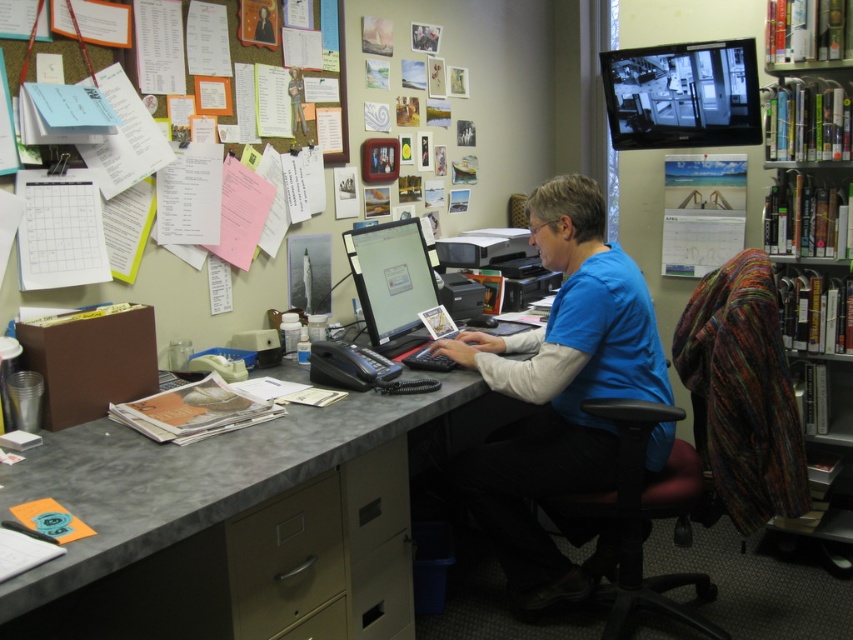
Question: Can you confirm if gray laminate desk at center is smaller than hardcover books at right?

Choices:
 (A) yes
 (B) no

Answer: (B)

Question: Is black plastic swivel chair at center above hardcover books at right?

Choices:
 (A) no
 (B) yes

Answer: (A)

Question: Which of the following is the closest to the observer?

Choices:
 (A) black plastic swivel chair at center
 (B) black glossy monitor at upper right
 (C) gray laminate desk at center
 (D) matte black monitor at center

Answer: (C)

Question: Estimate the real-world distances between objects in this image. Which object is farther from the blue cotton shirt at center?

Choices:
 (A) hardcover books at right
 (B) matte black monitor at center
 (C) gray laminate desk at center

Answer: (A)

Question: Can you confirm if blue cotton shirt at center is bigger than hardcover books at right?

Choices:
 (A) yes
 (B) no

Answer: (A)

Question: Considering the real-world distances, which object is closest to the black glossy monitor at upper right?

Choices:
 (A) gray laminate desk at center
 (B) black plastic swivel chair at center

Answer: (B)